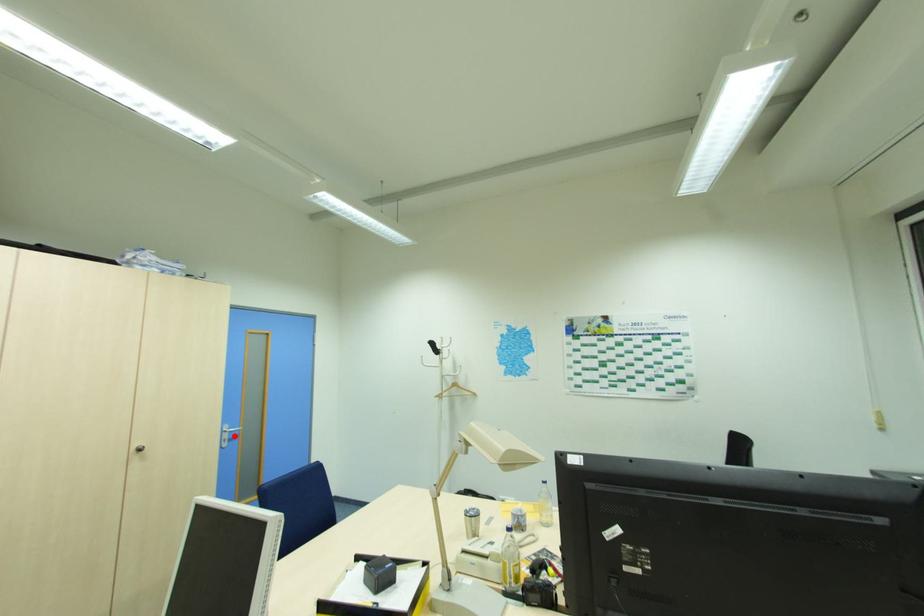
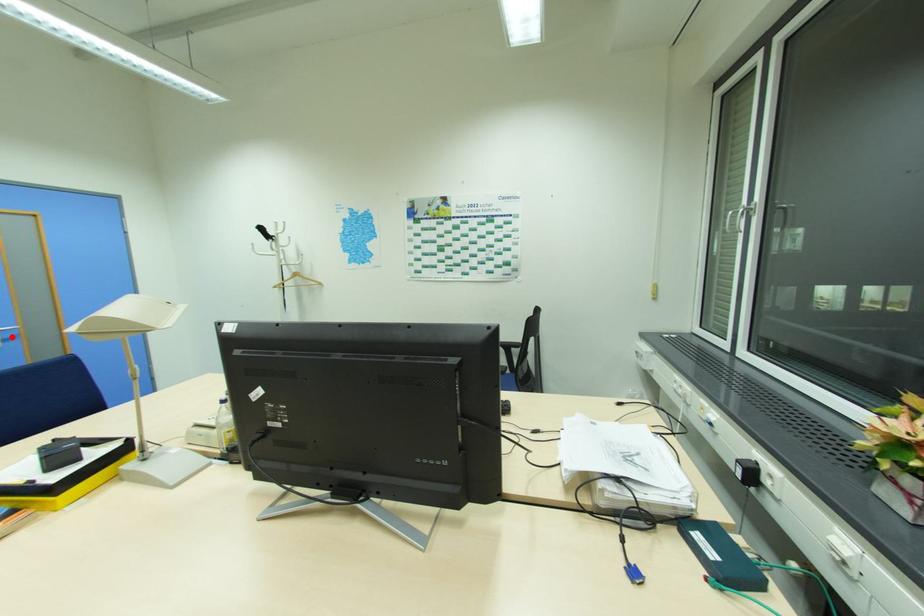
I am providing you with two images of the same scene from different viewpoints. A red point is marked on the first image and another point is marked on the second image. Is the red point in image1 aligned with the point shown in image2?

Yes